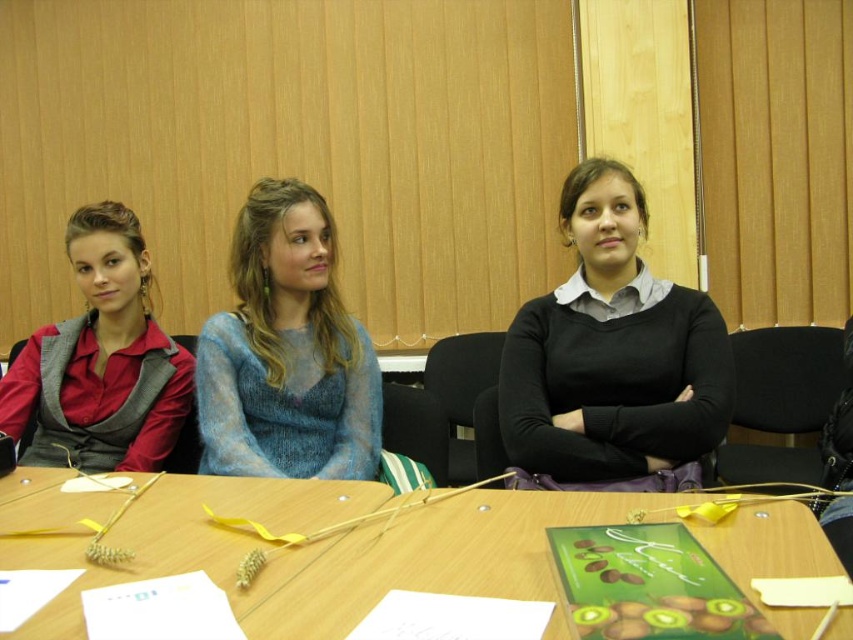
Image resolution: width=853 pixels, height=640 pixels. I want to click on black matte sweater at center, so click(612, 353).

Which is in front, point (691, 308) or point (328, 371)?

Point (691, 308) is more forward.

Does point (514, 317) lie in front of point (276, 256)?

No, (514, 317) is behind (276, 256).

Find the location of a particular element. black matte sweater at center is located at coordinates (612, 353).

Looking at this image, is black matte sweater at center smaller than matte red shirt at left?

Yes.

Between black matte sweater at center and matte red shirt at left, which one is positioned higher?

Positioned higher is black matte sweater at center.

What do you see at coordinates (612, 353) in the screenshot?
I see `black matte sweater at center` at bounding box center [612, 353].

What are the coordinates of `black matte sweater at center` in the screenshot? It's located at (612, 353).

Who is shorter, wooden table at center or matte red shirt at left?

wooden table at center is shorter.

How distant is wooden table at center from matte red shirt at left?

wooden table at center is 22.70 inches from matte red shirt at left.

In the scene shown: Measure the distance between point (648, 512) and camera.

The distance of point (648, 512) from camera is 4.16 feet.

The height and width of the screenshot is (640, 853). I want to click on wooden table at center, so click(328, 548).